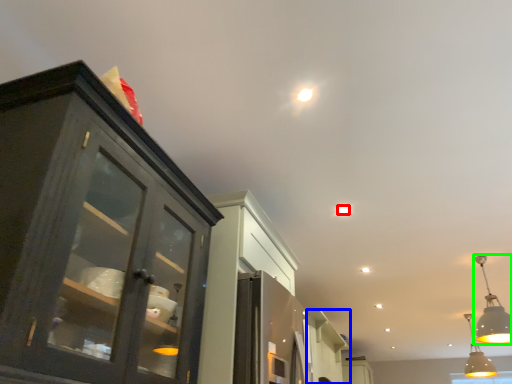
Question: Which object is the closest to the light (highlighted by a red box)? Choose among these: cabinetry (highlighted by a blue box) or light fixture (highlighted by a green box).

Choices:
 (A) cabinetry
 (B) light fixture

Answer: (B)